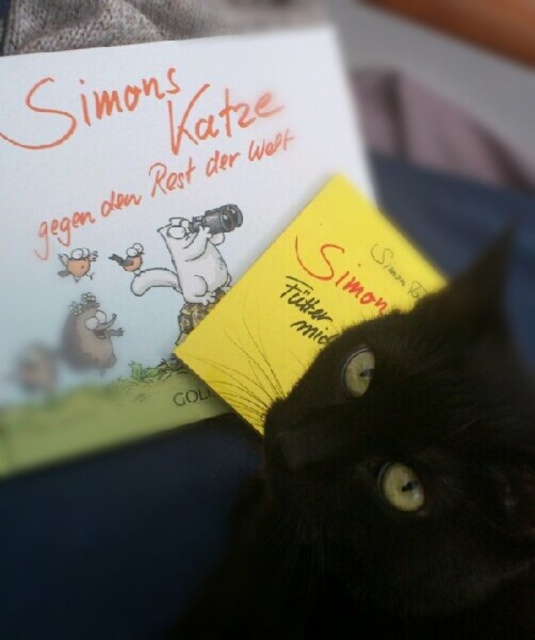
You are trying to locate the yellow paper card at upper center in the image. According to the scene description, where is it positioned relative to the black cat and the book titled

The yellow paper card at upper center is located at point (146, 218), which places it above the black cat and to the left of the book titled

You are a delivery person who just arrived at a house. You see a yellow paper card at upper center and a yellow paper at center on the door. Which one is taller?

The yellow paper card at upper center is much taller than the yellow paper at center.

You are trying to locate the black fur cat at center in the image. What are the coordinates where you can find it?

The black fur cat at center can be found at coordinates point [393,484].